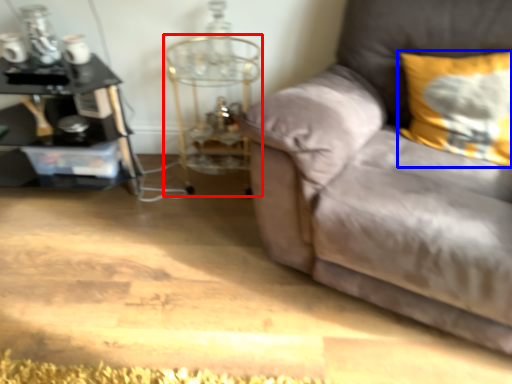
Question: Among these objects, which one is farthest to the camera, side table (highlighted by a red box) or pillow (highlighted by a blue box)?

Choices:
 (A) side table
 (B) pillow

Answer: (A)